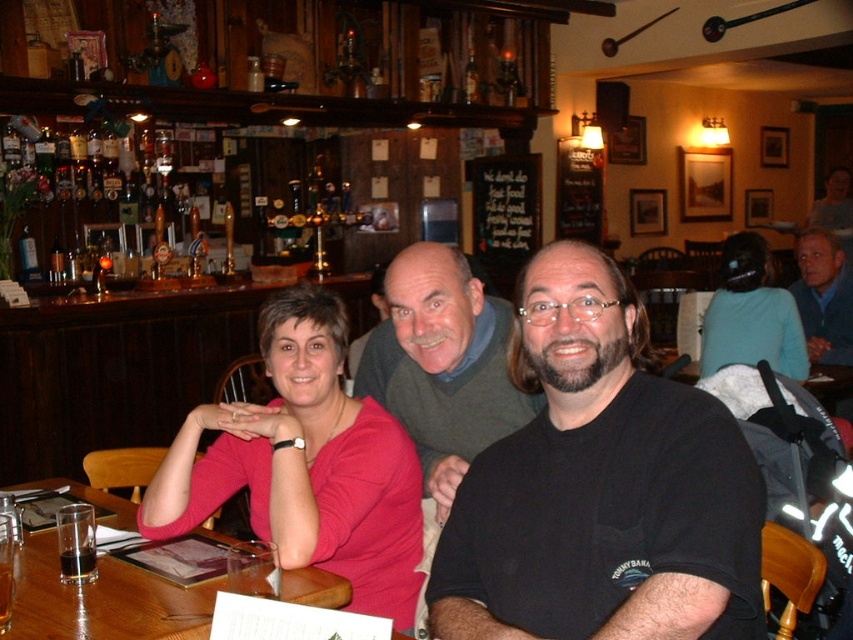
Question: Where is wooden table at lower left located in relation to blue sweater at upper right in the image?

Choices:
 (A) left
 (B) right

Answer: (A)

Question: Considering the real-world distances, which object is farthest from the black matte shirt at center?

Choices:
 (A) matte pink shirt at center
 (B) wooden table at lower left
 (C) blue sweater at upper right
 (D) green sweater at center

Answer: (C)

Question: Is wooden table at lower left above blue sweater at upper right?

Choices:
 (A) no
 (B) yes

Answer: (A)

Question: Which object appears closest to the camera in this image?

Choices:
 (A) blue sweater at upper right
 (B) wooden table at lower left

Answer: (B)

Question: Which object is positioned closest to the teal fabric shirt at upper right?

Choices:
 (A) wooden table at lower left
 (B) green sweater at center
 (C) matte pink shirt at center
 (D) black matte shirt at center

Answer: (B)

Question: Does black matte shirt at center have a lesser width compared to blue sweater at upper right?

Choices:
 (A) yes
 (B) no

Answer: (B)